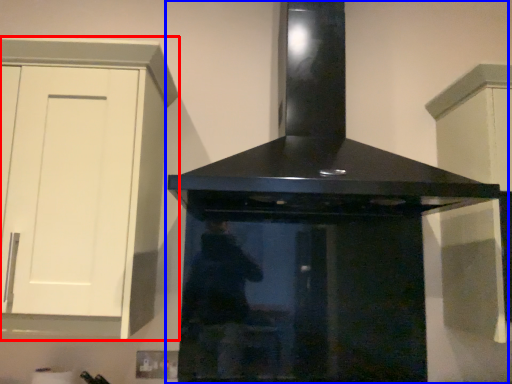
Question: Among these objects, which one is farthest to the camera, cabinetry (highlighted by a red box) or home appliance (highlighted by a blue box)?

Choices:
 (A) cabinetry
 (B) home appliance

Answer: (A)